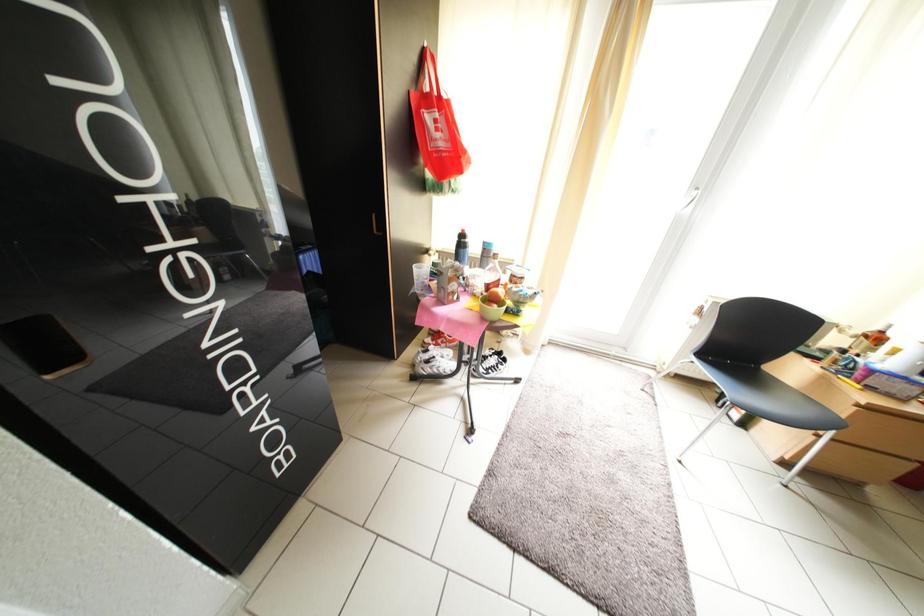
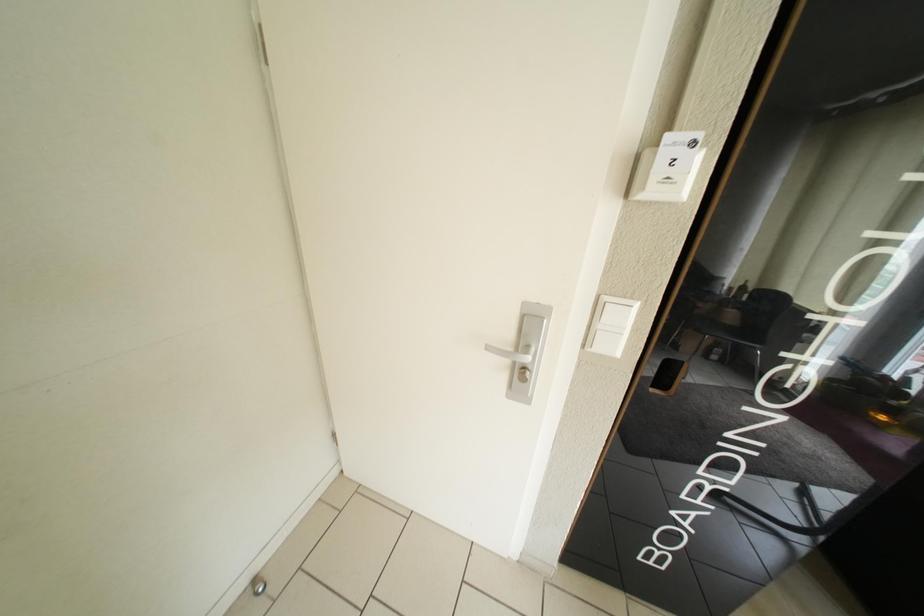
The first image is from the beginning of the video and the second image is from the end. How did the camera likely rotate when shooting the video?

The camera's rotation is toward left-down.